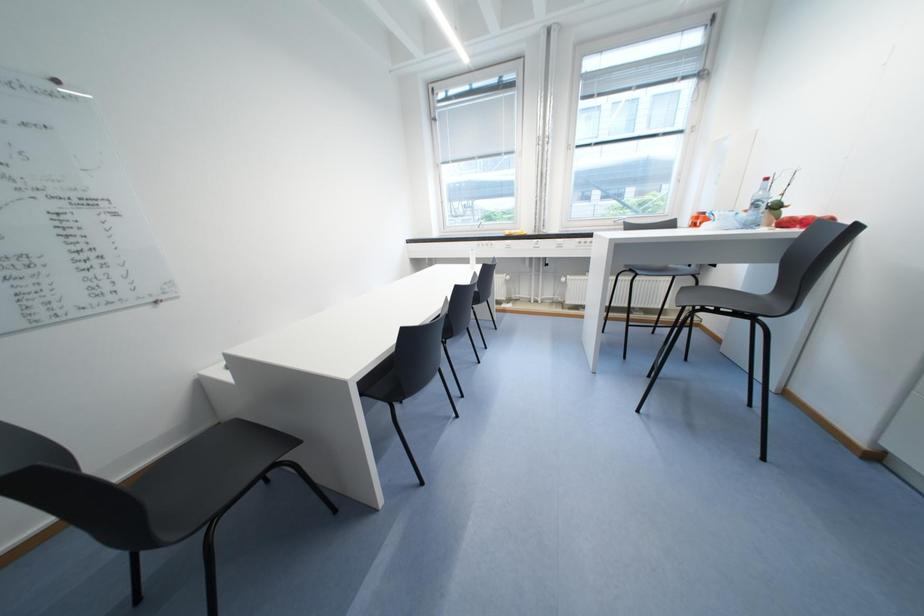
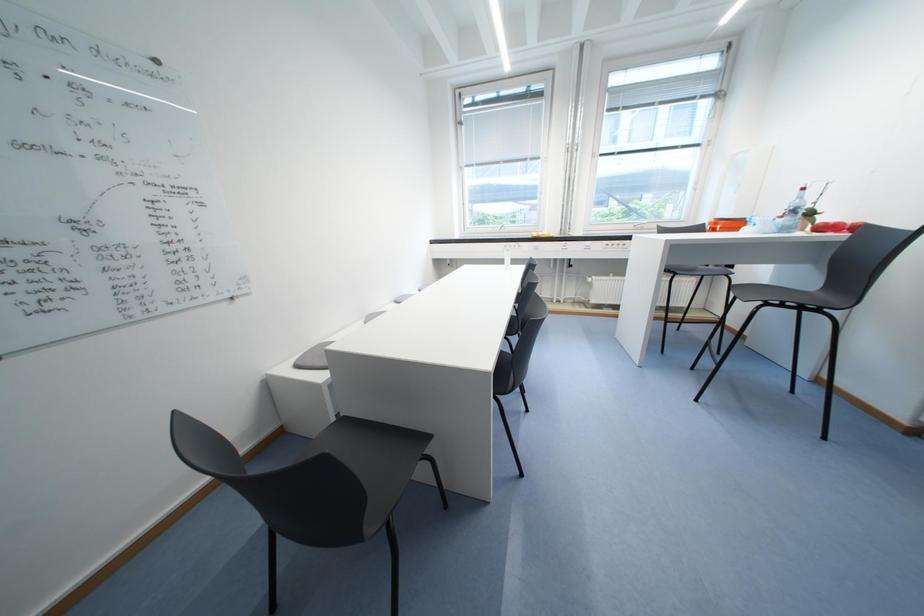
Question: Based on the continuous images, in which direction is the camera rotating? Reply with the corresponding letter.

Choices:
 (A) Left
 (B) Right
 (C) Up
 (D) Down

Answer: (B)